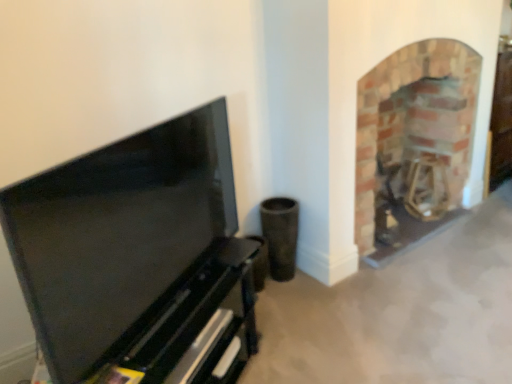
What do you see at coordinates (138, 259) in the screenshot? The width and height of the screenshot is (512, 384). I see `matte black tv stand at left` at bounding box center [138, 259].

Find the location of a particular element. The image size is (512, 384). matte black tv stand at left is located at coordinates (138, 259).

This screenshot has height=384, width=512. What do you see at coordinates (413, 144) in the screenshot?
I see `brick fireplace at right` at bounding box center [413, 144].

What is the approximate width of brick fireplace at right?

brick fireplace at right is 16.78 inches in width.

I want to click on brick fireplace at right, so click(x=413, y=144).

This screenshot has width=512, height=384. In order to click on matte black tv stand at left in this screenshot , I will do `click(138, 259)`.

Which is more to the right, brick fireplace at right or matte black tv stand at left?

From the viewer's perspective, brick fireplace at right appears more on the right side.

Is brick fireplace at right further to camera compared to matte black tv stand at left?

Yes, brick fireplace at right is further from the camera.

Is point (386, 116) closer to viewer compared to point (76, 181)?

No.

From the image's perspective, relative to matte black tv stand at left, is brick fireplace at right above or below?

Clearly, from the image's perspective, brick fireplace at right is above matte black tv stand at left.

From a real-world perspective, who is located higher, brick fireplace at right or matte black tv stand at left?

matte black tv stand at left is physically above.

Considering the sizes of objects brick fireplace at right and matte black tv stand at left in the image provided, who is wider, brick fireplace at right or matte black tv stand at left?

With larger width is brick fireplace at right.

Who is taller, brick fireplace at right or matte black tv stand at left?

brick fireplace at right is taller.

Looking at the image, does brick fireplace at right seem bigger or smaller compared to matte black tv stand at left?

brick fireplace at right is bigger than matte black tv stand at left.

Would you say brick fireplace at right is outside matte black tv stand at left?

Yes, brick fireplace at right is outside of matte black tv stand at left.

In the scene shown: Are brick fireplace at right and matte black tv stand at left making contact?

No, brick fireplace at right is not with matte black tv stand at left.

Is brick fireplace at right looking in the opposite direction of matte black tv stand at left?

No, brick fireplace at right's orientation is not away from matte black tv stand at left.

Measure the distance between brick fireplace at right and matte black tv stand at left.

brick fireplace at right and matte black tv stand at left are 4.15 feet apart.

Locate an element on the screen. entertainment center above the brick fireplace at right (from a real-world perspective) is located at coordinates (138, 259).

Considering the relative positions of matte black tv stand at left and brick fireplace at right in the image provided, is matte black tv stand at left to the right of brick fireplace at right from the viewer's perspective?

No.

Is the depth of matte black tv stand at left less than that of brick fireplace at right?

That is True.

Which is nearer, (193, 295) or (424, 232)?

Point (193, 295).

From the image's perspective, is matte black tv stand at left located beneath brick fireplace at right?

Indeed, from the image's perspective, matte black tv stand at left is shown beneath brick fireplace at right.

From a real-world perspective, is matte black tv stand at left above or below brick fireplace at right?

In terms of real-world spatial position, matte black tv stand at left is above brick fireplace at right.

In the scene shown: Which of these two, matte black tv stand at left or brick fireplace at right, is wider?

Wider between the two is brick fireplace at right.

Who is shorter, matte black tv stand at left or brick fireplace at right?

matte black tv stand at left is shorter.

Is matte black tv stand at left smaller than brick fireplace at right?

Yes.

Is matte black tv stand at left situated inside brick fireplace at right or outside?

matte black tv stand at left lies outside brick fireplace at right.

Is matte black tv stand at left not near brick fireplace at right?

Yes, matte black tv stand at left and brick fireplace at right are located far from each other.

Does matte black tv stand at left turn towards brick fireplace at right?

No, matte black tv stand at left is not turned towards brick fireplace at right.

Looking at this image, what's the angular difference between matte black tv stand at left and brick fireplace at right's facing directions?

The angular difference between matte black tv stand at left and brick fireplace at right is 31.4 degrees.

You are a GUI agent. You are given a task and a screenshot of the screen. Output one action in this format:
    pyautogui.click(x=<x>, y=<y>)
    Task: Click on the fireplace behind the matte black tv stand at left
    The width and height of the screenshot is (512, 384).
    Given the screenshot: What is the action you would take?
    tap(413, 144)

The image size is (512, 384). Find the location of `fireplace on the right of matte black tv stand at left`. fireplace on the right of matte black tv stand at left is located at coordinates point(413,144).

Where is `entertainment center below the brick fireplace at right (from the image's perspective)`? entertainment center below the brick fireplace at right (from the image's perspective) is located at coordinates (138, 259).